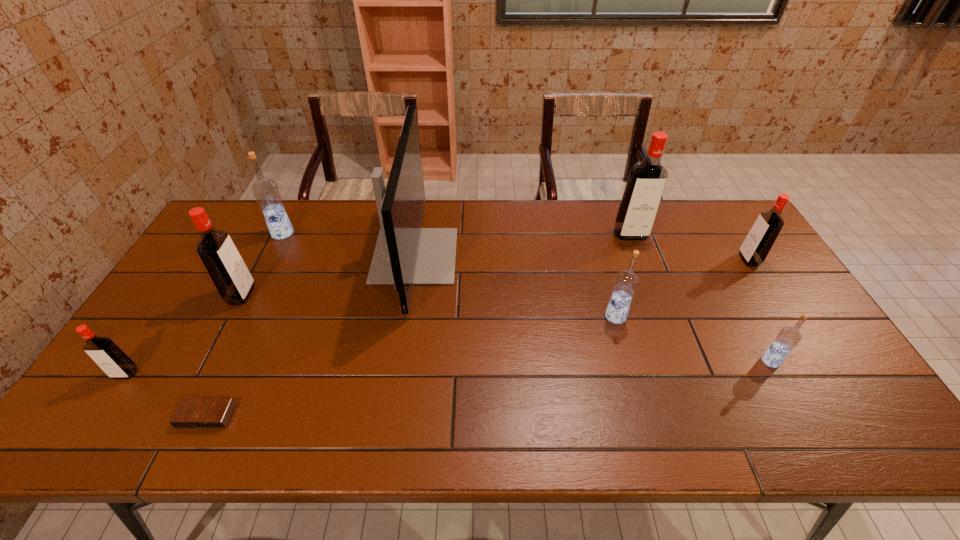
The width and height of the screenshot is (960, 540). In the image, there is a desktop. What are the coordinates of `vacant space at the far edge` in the screenshot? It's located at (531, 234).

In the image, there is a desktop. At what (x,y) coordinates should I click in order to perform the action: click on vacant space at the near edge. Please return your answer as a coordinate pair (x, y). This screenshot has height=540, width=960. Looking at the image, I should click on (505, 438).

I want to click on vacant space at the right edge of the desktop, so click(x=721, y=258).

At what (x,y) coordinates should I click in order to perform the action: click on vacant space at the far right corner of the desktop. Please return your answer as a coordinate pair (x, y). This screenshot has width=960, height=540. Looking at the image, I should click on (716, 236).

Identify the location of vacant point located between the shortest object and the smallest blue vodka. This screenshot has height=540, width=960. (489, 389).

Where is `free space between the second object from right to left and the third smallest red vodka`? free space between the second object from right to left and the third smallest red vodka is located at coordinates (506, 328).

Find the location of a particular element. unoccupied area between the smallest red vodka and the farthest blue vodka is located at coordinates (204, 303).

Locate an element on the screen. The image size is (960, 540). free space between the rightmost vodka and the biggest blue vodka is located at coordinates (516, 246).

At what (x,y) coordinates should I click in order to perform the action: click on free space between the biggest red vodka and the leftmost red vodka. Please return your answer as a coordinate pair (x, y). Looking at the image, I should click on (378, 304).

Find the location of a particular element. This screenshot has width=960, height=540. vacant area that lies between the leftmost red vodka and the second smallest red vodka is located at coordinates (438, 316).